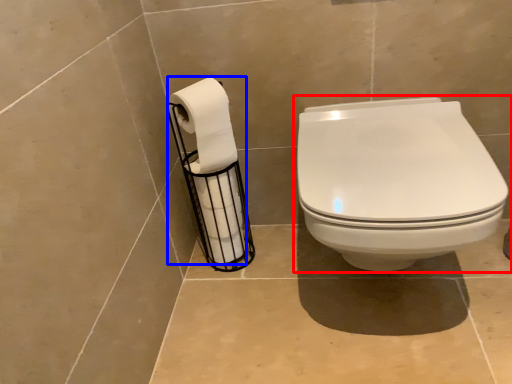
Question: Which object appears closest to the camera in this image, toilet (highlighted by a red box) or toilet paper (highlighted by a blue box)?

Choices:
 (A) toilet
 (B) toilet paper

Answer: (A)